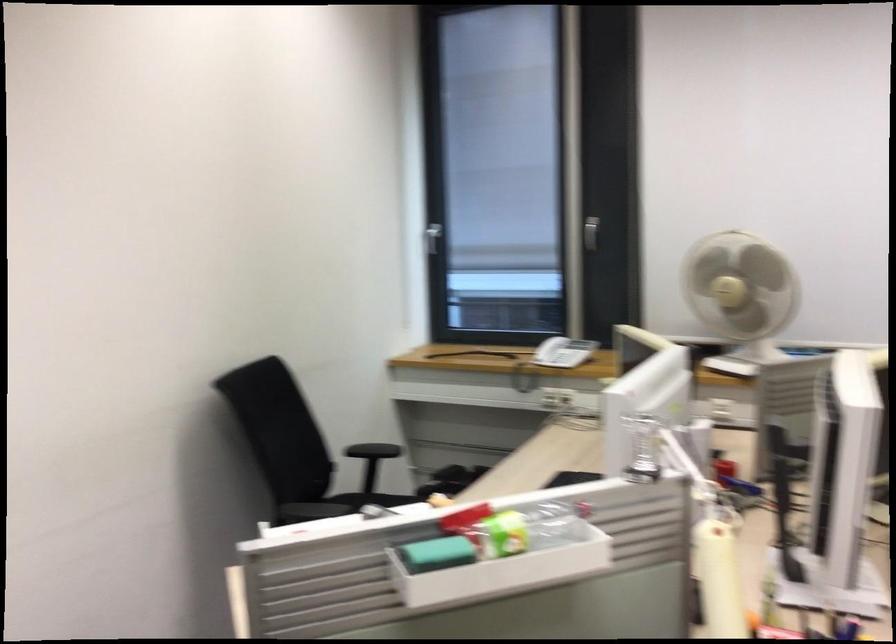
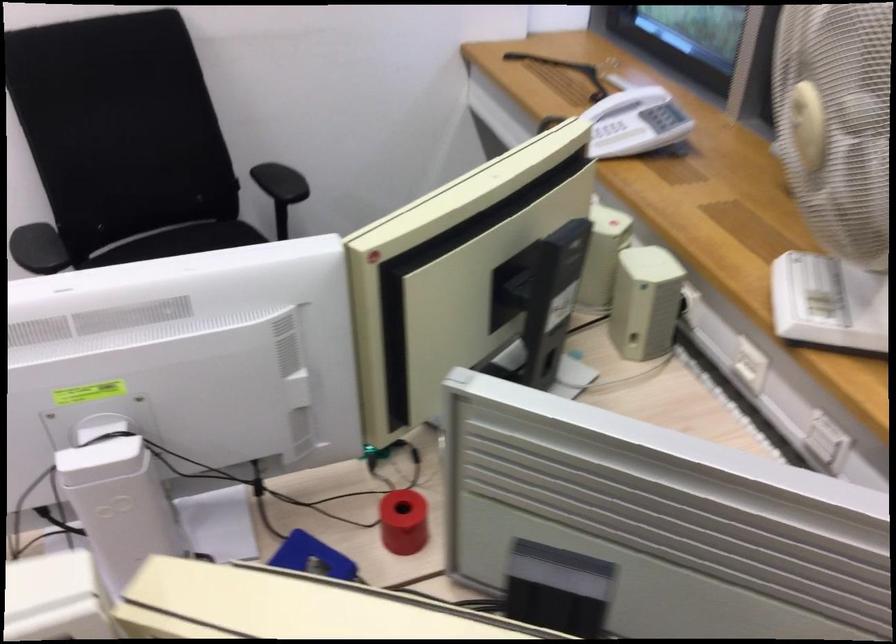
Where in the second image is the point corresponding to point 716,272 from the first image?

(807, 125)